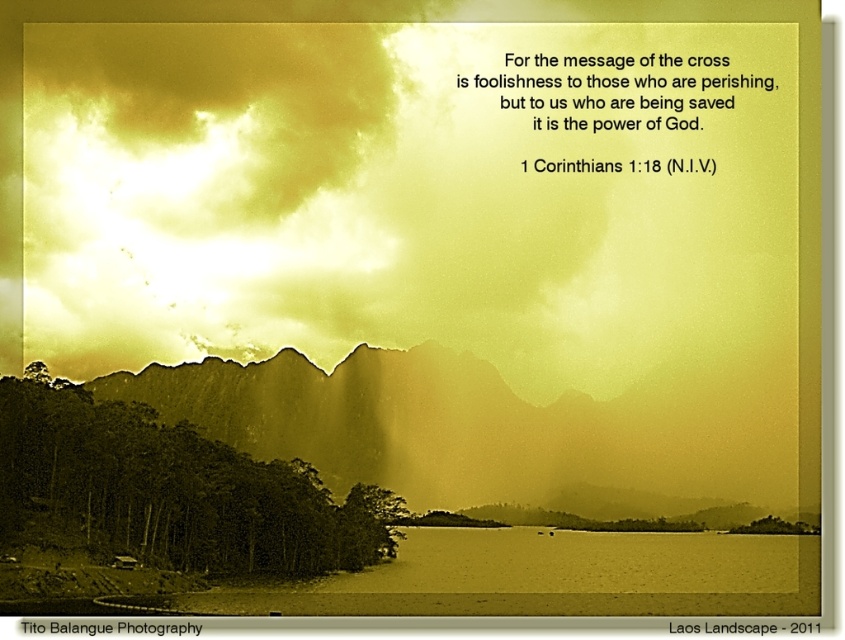
You are an artist planning to paint this landscape. You want to ensure the golden textured sky at upper center and the sepia textured mountain at center are proportionally accurate. Which object should you paint taller in your artwork?

The golden textured sky at upper center should be painted taller because it has a greater height compared to the sepia textured mountain at center according to the description.